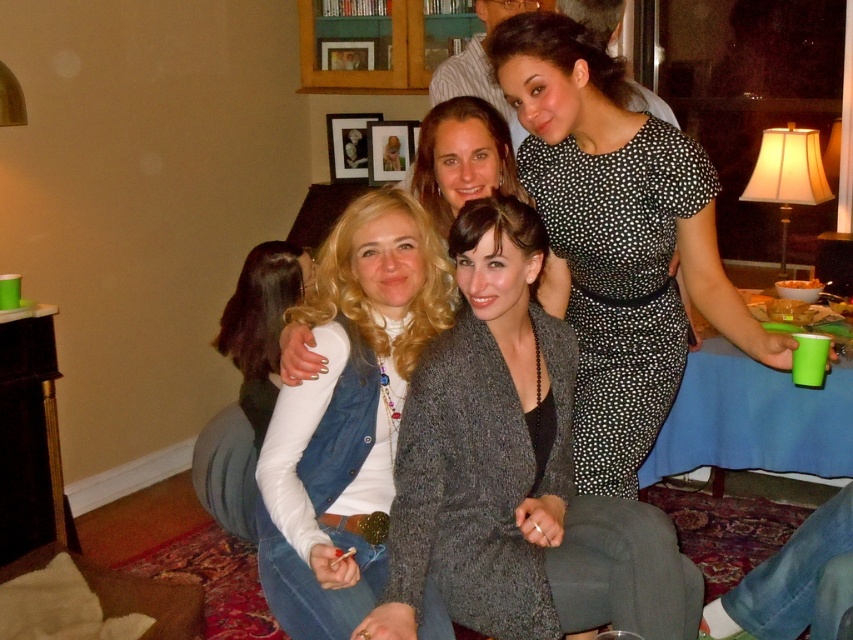
You are a photographer setting up for a group photo. You need to ensure that the black dotted dress at upper center and the matte white sweater at center are within a 1 meter distance to frame them properly. Based on the scene description, can you confirm if they are close enough?

The black dotted dress at upper center and the matte white sweater at center are 1.01 meters apart, which is slightly over the 1 meter requirement. Therefore, they are not close enough to be framed properly within the specified distance.

You are a photographer setting up for a group photo. You need to ensure that the denim vest at center and the matte white sweater at center are at least 30 inches apart to frame them properly. Based on the scene, can they be positioned as required?

The denim vest at center is only 28.07 inches away from the matte white sweater at center, which is less than the required 30 inches. Therefore, they cannot be positioned as required for proper framing.